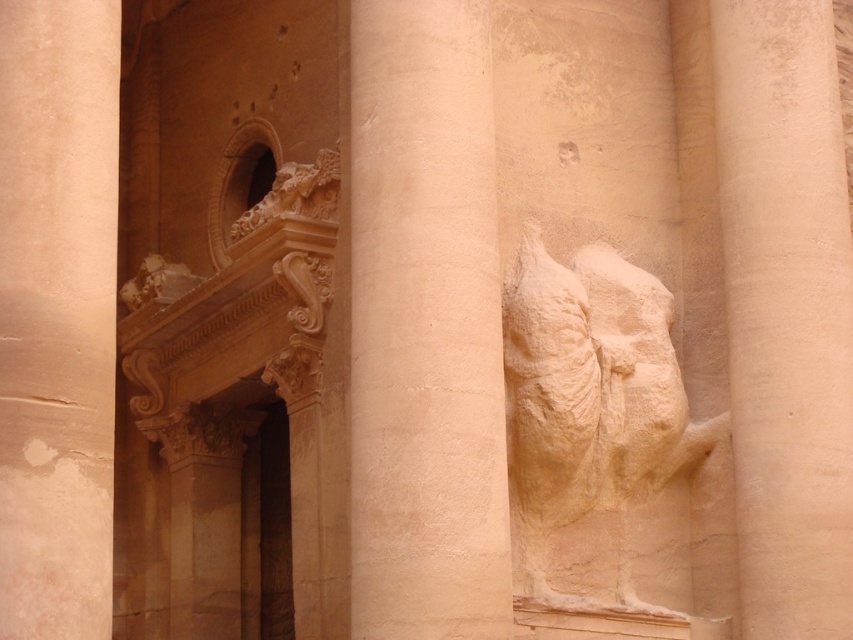
Measure the distance between smooth sandstone column at center and beige stone relief at right.

7.02 meters

Does smooth sandstone column at center lie in front of beige stone relief at right?

Yes, it is.

Is point (421, 536) positioned in front of point (570, 598)?

Yes, point (421, 536) is closer to viewer.

Locate an element on the screen. This screenshot has width=853, height=640. smooth sandstone column at center is located at coordinates tap(425, 326).

Does smooth sandstone column at center come in front of smooth sandstone column at right?

Yes, it is.

Is point (439, 33) more distant than point (805, 589)?

No, it is not.

At what (x,y) coordinates should I click in order to perform the action: click on smooth sandstone column at center. Please return your answer as a coordinate pair (x, y). This screenshot has height=640, width=853. Looking at the image, I should click on (425, 326).

Is smooth sandstone pillar at center further to camera compared to beige stone relief at right?

No, it is in front of beige stone relief at right.

Does point (41, 214) come closer to viewer compared to point (601, 280)?

Yes, it is.

Which is behind, point (61, 225) or point (601, 435)?

The point (601, 435) is more distant.

The width and height of the screenshot is (853, 640). I want to click on smooth sandstone pillar at center, so [x=57, y=314].